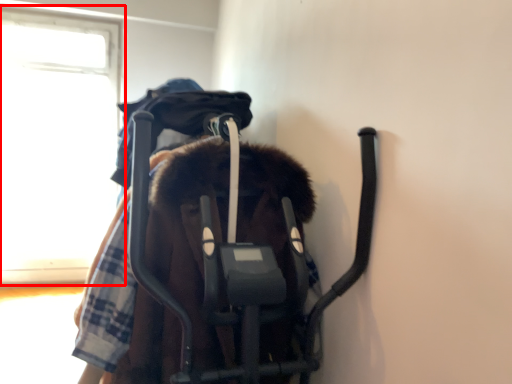
Question: From the image's perspective, what is the correct spatial positioning of window (annotated by the red box) in reference to baby elephant?

Choices:
 (A) below
 (B) above

Answer: (B)